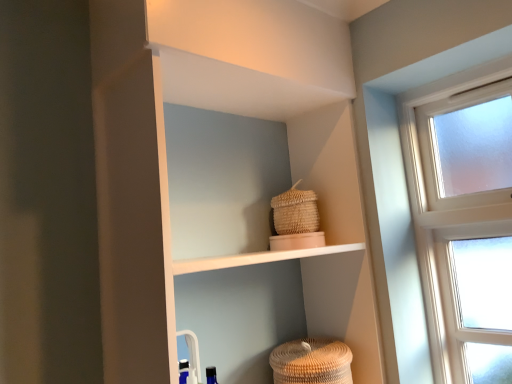
Question: Considering the positions of point (351, 357) and point (312, 228), is point (351, 357) closer or farther from the camera than point (312, 228)?

Choices:
 (A) farther
 (B) closer

Answer: (B)

Question: From a real-world perspective, is brown woven basket at lower center, the first basket when ordered from bottom to top, physically located above or below woven straw basket at upper center, which ranks as the 2th basket in bottom-to-top order?

Choices:
 (A) above
 (B) below

Answer: (B)

Question: Which is nearer to the white matte shelf at upper center?

Choices:
 (A) woven straw basket at upper center, the first basket viewed from the top
 (B) brown woven basket at lower center, the first basket when ordered from bottom to top

Answer: (A)

Question: Based on their relative distances, which object is nearer to the brown woven basket at lower center, the first basket when ordered from bottom to top?

Choices:
 (A) white matte shelf at upper center
 (B) woven straw basket at upper center, which ranks as the 2th basket in bottom-to-top order

Answer: (B)